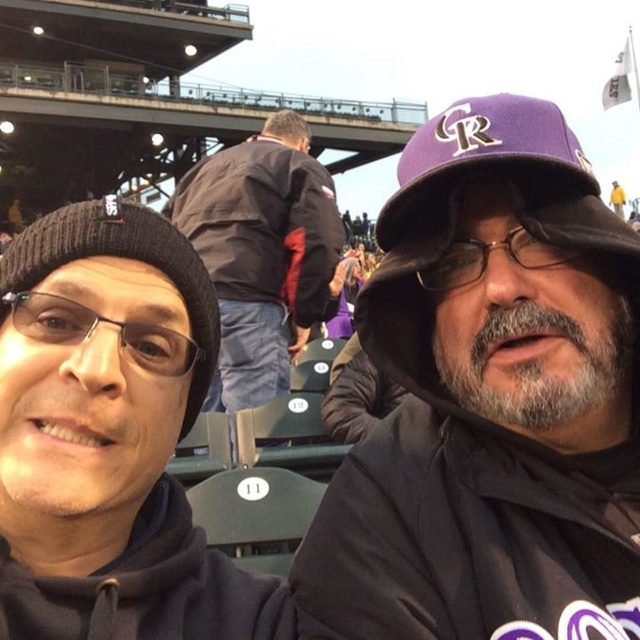
Question: Can you confirm if black knit cap at upper left is positioned above yellow fabric at upper right?

Choices:
 (A) no
 (B) yes

Answer: (A)

Question: Can you confirm if purple matte baseball cap at center is smaller than transparent plastic glasses at left?

Choices:
 (A) yes
 (B) no

Answer: (B)

Question: Which of the following is the closest to the observer?

Choices:
 (A) black knit cap at upper left
 (B) black knit beanie at left

Answer: (A)

Question: Which point is closer to the camera taking this photo?

Choices:
 (A) (104, 240)
 (B) (116, 497)
 (C) (620, 211)
 (D) (452, 273)

Answer: (B)

Question: Which point is closer to the camera?

Choices:
 (A) (161, 225)
 (B) (616, 192)
 (C) (528, 241)

Answer: (A)

Question: Is dark blue jacket at center behind black knit beanie at left?

Choices:
 (A) yes
 (B) no

Answer: (A)